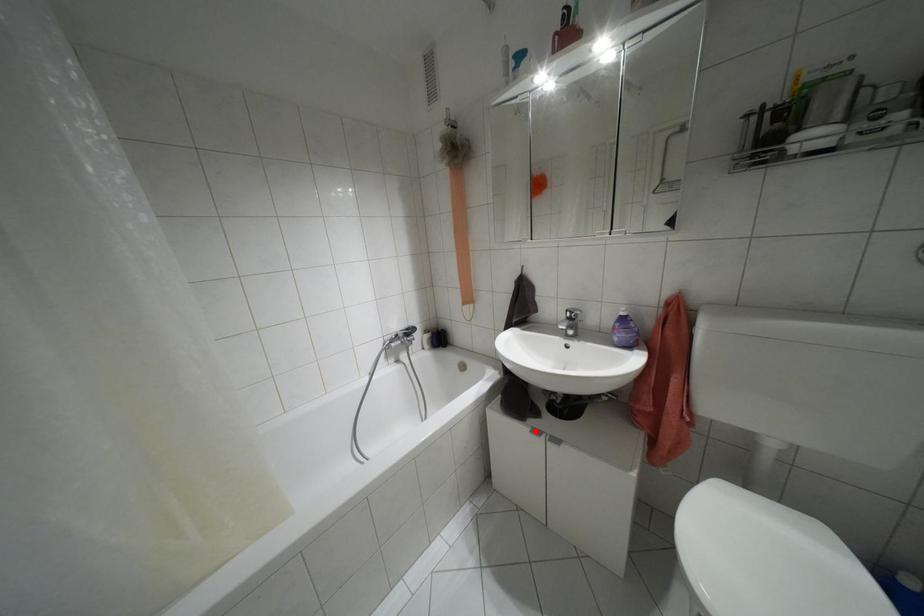
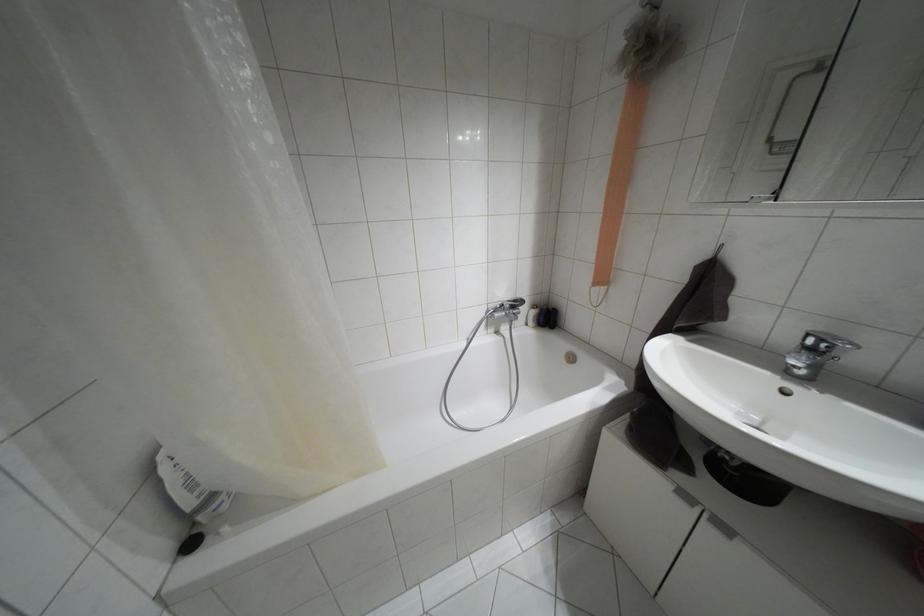
Question: A red point is marked in image1. In image2, is the corresponding 3D point closer to the camera or farther? Reply with the corresponding letter.

Choices:
 (A) The corresponding 3D point is closer.
 (B) The corresponding 3D point is farther.

Answer: (A)